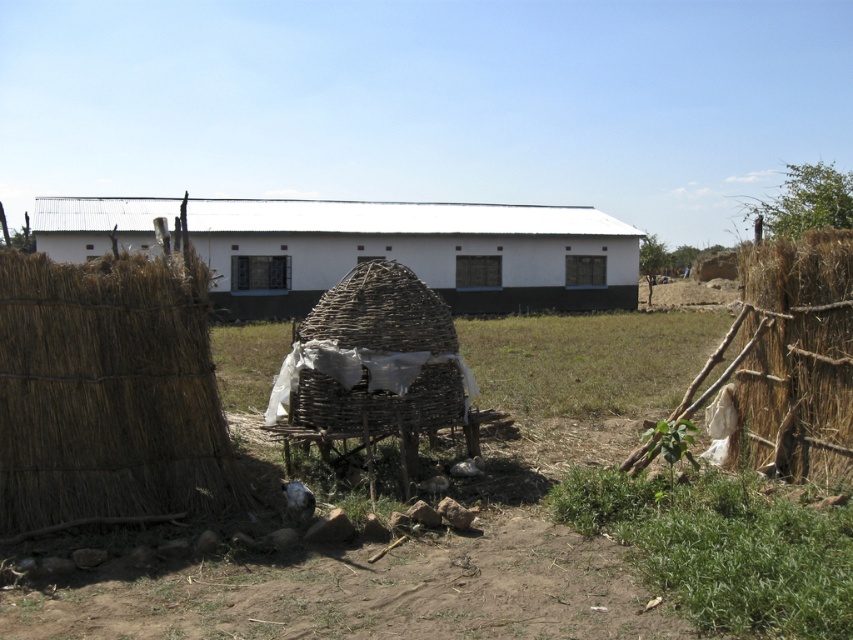
You are a hiker who needs to set up a tent between the white corrugated metal building at center and the brown straw hay at right. The tent requires a minimum distance of 20 meters from both structures for safety. Can you safely set up the tent in this area?

The white corrugated metal building at center is 30.36 meters away from the brown straw hay at right. Since the required minimum distance between the tent and both structures is 20 meters, the total required space would be at least 40 meters. However, the actual distance between the two structures is only 30.36 meters, which is insufficient. Therefore, you cannot safely set up the tent in this area.

You are a delivery person trying to decide whether to park your truck between the brown woven hay at left and the white corrugated metal building at center. Considering their thickness, which side should you choose to park closer to for better visibility?

The brown woven hay at left is thinner than the white corrugated metal building at center, so parking closer to the brown woven hay at left would provide better visibility since it is less obstructive.

You are a visitor approaching the white corrugated metal building at center and notice the brown woven hay at left nearby. From your perspective, which object appears closer to you?

The brown woven hay at left appears closer because it is in front of the white corrugated metal building at center, placing it nearer to your viewpoint.